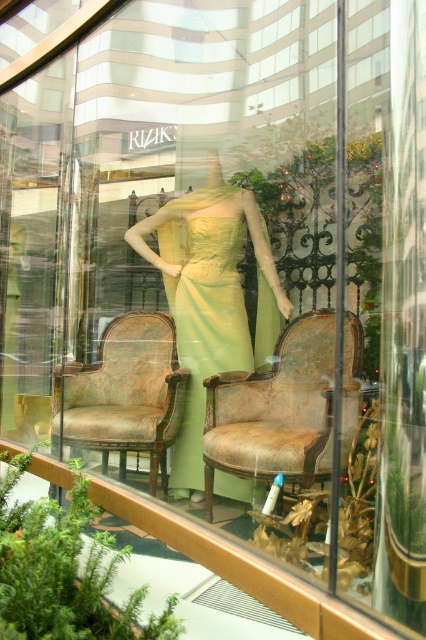
You are a customer looking at the window display of a boutique. You see a mannequin dressed in a flowing light green strapless gown at center and two vintage chairs on either side. There is a point marked at coordinates [210,298]. Can you tell me what object this point is located on?

The point at coordinates [210,298] is located on the matte yellow dress at center.

You are a customer in a boutique and see the window display featuring the matte yellow dress at center and the lime green satin dress at center. Which dress is positioned higher in the display?

The matte yellow dress at center is located above the lime green satin dress at center, so it is positioned higher in the display.

You are a fashion designer who wants to place a new accessory on the wider dress between the matte yellow dress at center and the lime green satin dress at center. Which dress should you choose?

The matte yellow dress at center might be wider than the lime green satin dress at center, so you should choose the matte yellow dress at center to place the accessory.